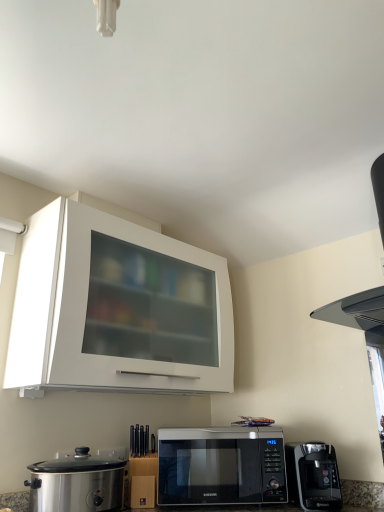
Question: Can you confirm if black matte vent at upper right is positioned to the left of black glossy microwave at lower center?

Choices:
 (A) yes
 (B) no

Answer: (B)

Question: From the image's perspective, is black matte vent at upper right beneath black glossy microwave at lower center?

Choices:
 (A) yes
 (B) no

Answer: (B)

Question: Is black matte vent at upper right facing towards black glossy microwave at lower center?

Choices:
 (A) yes
 (B) no

Answer: (B)

Question: Is black matte vent at upper right not within black glossy microwave at lower center?

Choices:
 (A) yes
 (B) no

Answer: (A)

Question: Is black matte vent at upper right bigger than black glossy microwave at lower center?

Choices:
 (A) yes
 (B) no

Answer: (A)

Question: From their relative heights in the image, would you say black glossy microwave at lower center is taller or shorter than black plastic coffee maker at lower right?

Choices:
 (A) tall
 (B) short

Answer: (A)

Question: Is black glossy microwave at lower center to the left or to the right of black plastic coffee maker at lower right in the image?

Choices:
 (A) left
 (B) right

Answer: (A)

Question: Would you say black glossy microwave at lower center is inside or outside black plastic coffee maker at lower right?

Choices:
 (A) inside
 (B) outside

Answer: (B)

Question: Looking at their shapes, would you say black glossy microwave at lower center is wider or thinner than black plastic coffee maker at lower right?

Choices:
 (A) thin
 (B) wide

Answer: (B)

Question: Considering the positions of black plastic coffee maker at lower right and black matte vent at upper right in the image, is black plastic coffee maker at lower right taller or shorter than black matte vent at upper right?

Choices:
 (A) tall
 (B) short

Answer: (B)

Question: Is black plastic coffee maker at lower right wider or thinner than black matte vent at upper right?

Choices:
 (A) wide
 (B) thin

Answer: (B)

Question: Relative to black matte vent at upper right, is black plastic coffee maker at lower right in front or behind?

Choices:
 (A) behind
 (B) front

Answer: (A)

Question: From the image's perspective, is black plastic coffee maker at lower right above or below black matte vent at upper right?

Choices:
 (A) above
 (B) below

Answer: (B)

Question: Is black glossy microwave at lower center spatially inside stainless steel slow cooker at lower left, or outside of it?

Choices:
 (A) inside
 (B) outside

Answer: (B)

Question: Does point (162, 489) appear closer or farther from the camera than point (49, 489)?

Choices:
 (A) farther
 (B) closer

Answer: (A)